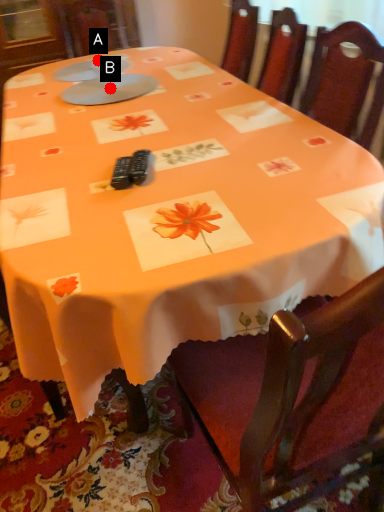
Question: Two points are circled on the image, labeled by A and B beside each circle. Which point is farther to the camera?

Choices:
 (A) A is further
 (B) B is further

Answer: (A)